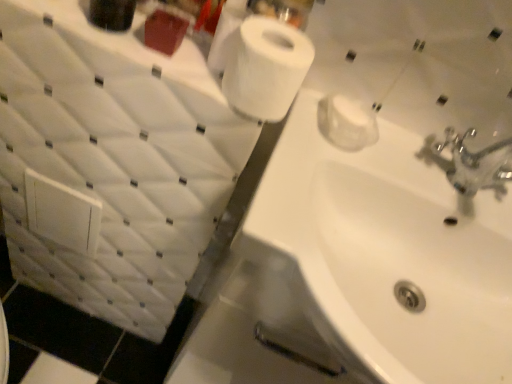
The width and height of the screenshot is (512, 384). Describe the element at coordinates (266, 68) in the screenshot. I see `white matte toilet paper at upper center` at that location.

Where is `white matte toilet paper at upper center`? The width and height of the screenshot is (512, 384). white matte toilet paper at upper center is located at coordinates (266, 68).

The width and height of the screenshot is (512, 384). What do you see at coordinates (379, 258) in the screenshot? I see `white glossy sink at center` at bounding box center [379, 258].

Identify the location of white glossy sink at center. This screenshot has height=384, width=512. (379, 258).

The image size is (512, 384). Find the location of `white matte toilet paper at upper center`. white matte toilet paper at upper center is located at coordinates [x=266, y=68].

Can you confirm if white matte toilet paper at upper center is positioned to the left of white glossy sink at center?

Yes, white matte toilet paper at upper center is to the left of white glossy sink at center.

Considering the positions of objects white matte toilet paper at upper center and white glossy sink at center in the image provided, who is behind, white matte toilet paper at upper center or white glossy sink at center?

white glossy sink at center is further away from the camera.

Does point (273, 48) come behind point (470, 308)?

No, (273, 48) is in front of (470, 308).

From the image's perspective, who appears lower, white matte toilet paper at upper center or white glossy sink at center?

white glossy sink at center.

From a real-world perspective, does white matte toilet paper at upper center stand above white glossy sink at center?

Indeed, from a real-world perspective, white matte toilet paper at upper center stands above white glossy sink at center.

Is white matte toilet paper at upper center thinner than white glossy sink at center?

Yes.

Considering the relative sizes of white matte toilet paper at upper center and white glossy sink at center in the image provided, is white matte toilet paper at upper center shorter than white glossy sink at center?

Yes, white matte toilet paper at upper center is shorter than white glossy sink at center.

Considering the relative sizes of white matte toilet paper at upper center and white glossy sink at center in the image provided, is white matte toilet paper at upper center smaller than white glossy sink at center?

Indeed, white matte toilet paper at upper center has a smaller size compared to white glossy sink at center.

Is white matte toilet paper at upper center situated inside white glossy sink at center or outside?

white matte toilet paper at upper center exists outside the volume of white glossy sink at center.

Is white matte toilet paper at upper center far away from white glossy sink at center?

No, there isn't a large distance between white matte toilet paper at upper center and white glossy sink at center.

Is white matte toilet paper at upper center oriented towards white glossy sink at center?

No, white matte toilet paper at upper center is not oriented towards white glossy sink at center.

Measure the distance from white matte toilet paper at upper center to white glossy sink at center.

A distance of 10.61 inches exists between white matte toilet paper at upper center and white glossy sink at center.

Identify the location of toilet paper above the white glossy sink at center (from a real-world perspective). This screenshot has width=512, height=384. (266, 68).

Can you confirm if white glossy sink at center is positioned to the left of white matte toilet paper at upper center?

No, white glossy sink at center is not to the left of white matte toilet paper at upper center.

Which object is more forward, white glossy sink at center or white matte toilet paper at upper center?

white matte toilet paper at upper center is more forward.

Does point (263, 290) come farther from viewer compared to point (293, 94)?

Yes, it is behind point (293, 94).

From the image's perspective, is white glossy sink at center on top of white matte toilet paper at upper center?

No, from the image's perspective, white glossy sink at center is not on top of white matte toilet paper at upper center.

From a real-world perspective, which is physically above, white glossy sink at center or white matte toilet paper at upper center?

From a 3D spatial view, white matte toilet paper at upper center is above.

Is white glossy sink at center thinner than white matte toilet paper at upper center?

In fact, white glossy sink at center might be wider than white matte toilet paper at upper center.

Considering the sizes of white glossy sink at center and white matte toilet paper at upper center in the image, is white glossy sink at center taller or shorter than white matte toilet paper at upper center?

In the image, white glossy sink at center appears to be taller than white matte toilet paper at upper center.

Between white glossy sink at center and white matte toilet paper at upper center, which one has larger size?

Bigger between the two is white glossy sink at center.

Consider the image. Would you say white matte toilet paper at upper center is part of white glossy sink at center's contents?

No, white glossy sink at center does not contain white matte toilet paper at upper center.

Based on the photo, is white glossy sink at center positioned far away from white matte toilet paper at upper center?

That's not correct — white glossy sink at center is a little close to white matte toilet paper at upper center.

Is white glossy sink at center oriented towards white matte toilet paper at upper center?

No, white glossy sink at center is not facing towards white matte toilet paper at upper center.

How many degrees apart are the facing directions of white glossy sink at center and white matte toilet paper at upper center?

1.58 degrees.

There is a white glossy sink at center. At what (x,y) coordinates should I click in order to perform the action: click on toilet paper above it (from a real-world perspective). Please return your answer as a coordinate pair (x, y). The width and height of the screenshot is (512, 384). Looking at the image, I should click on (266, 68).

Where is `sink that is behind the white matte toilet paper at upper center`? sink that is behind the white matte toilet paper at upper center is located at coordinates (379, 258).

Locate an element on the screen. toilet paper on the left side of white glossy sink at center is located at coordinates (266, 68).